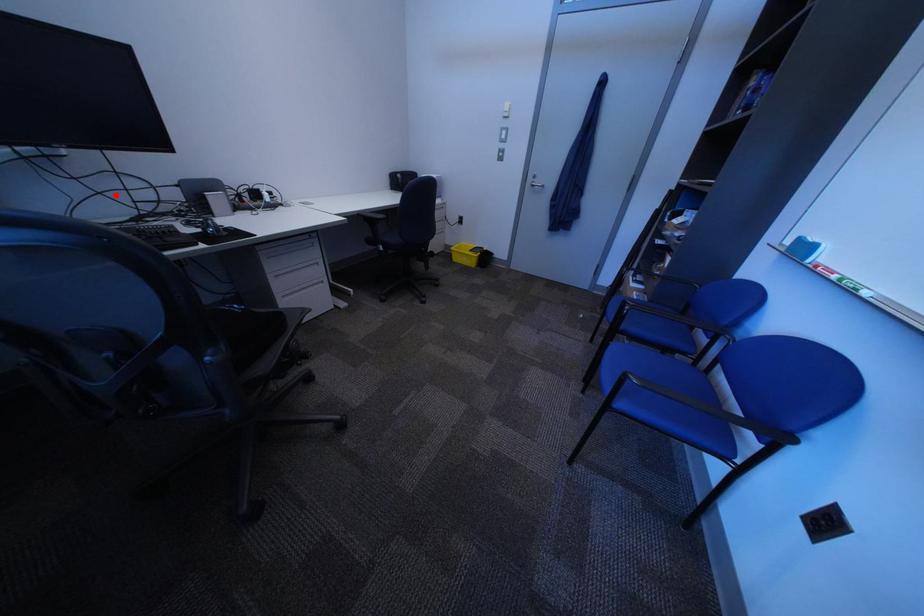
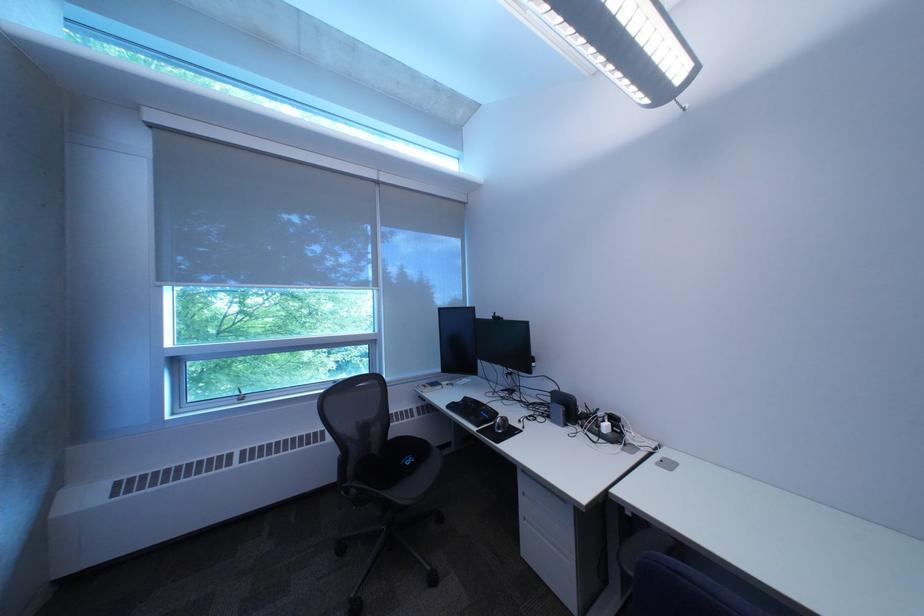
Locate, in the second image, the point that corresponds to the highlighted location in the first image.

(532, 387)